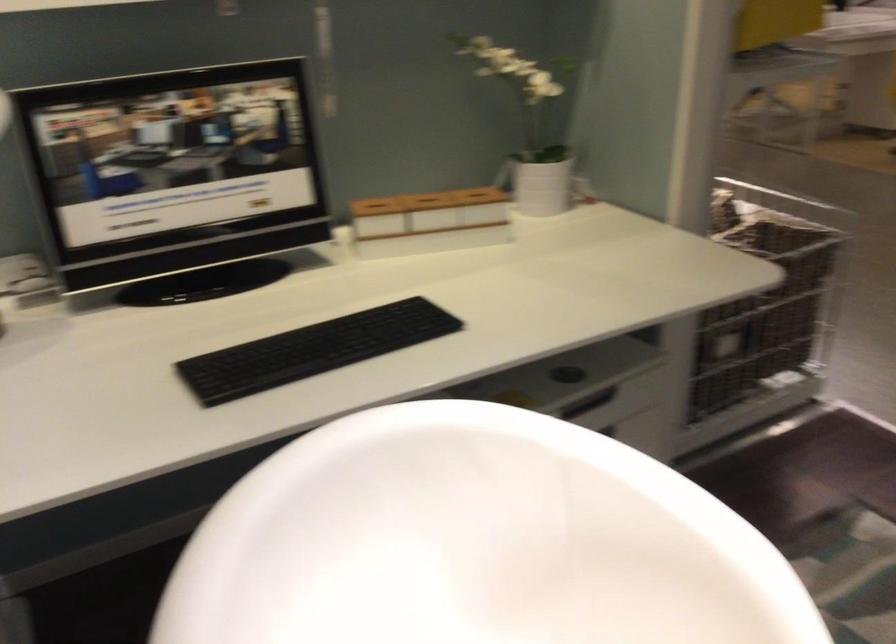
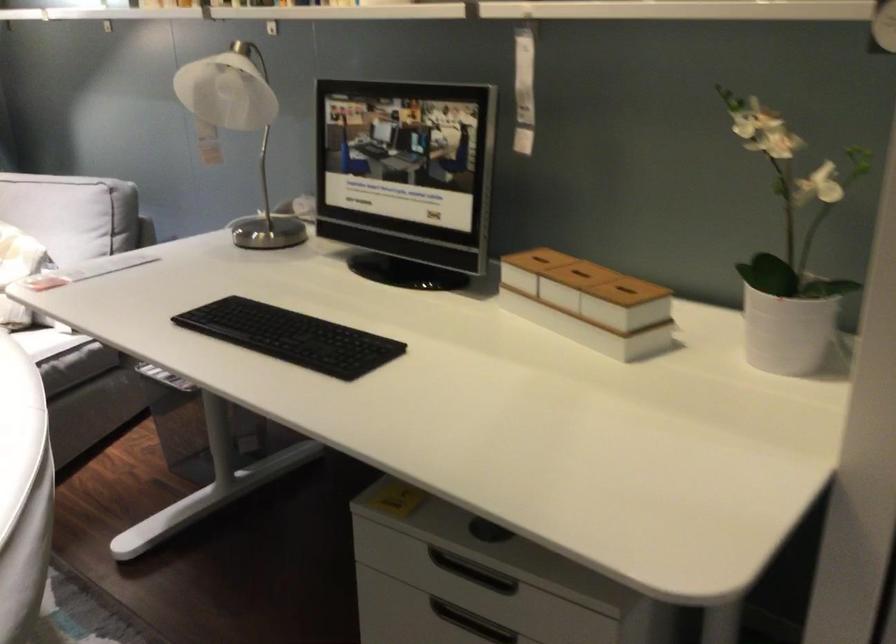
The point at (384, 205) is marked in the first image. Where is the corresponding point in the second image?

(537, 259)